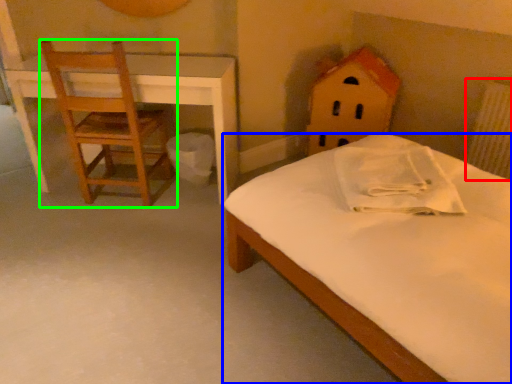
Question: Based on their relative distances, which object is nearer to radiator (highlighted by a red box)? Choose from bed (highlighted by a blue box) and chair (highlighted by a green box).

Choices:
 (A) bed
 (B) chair

Answer: (A)